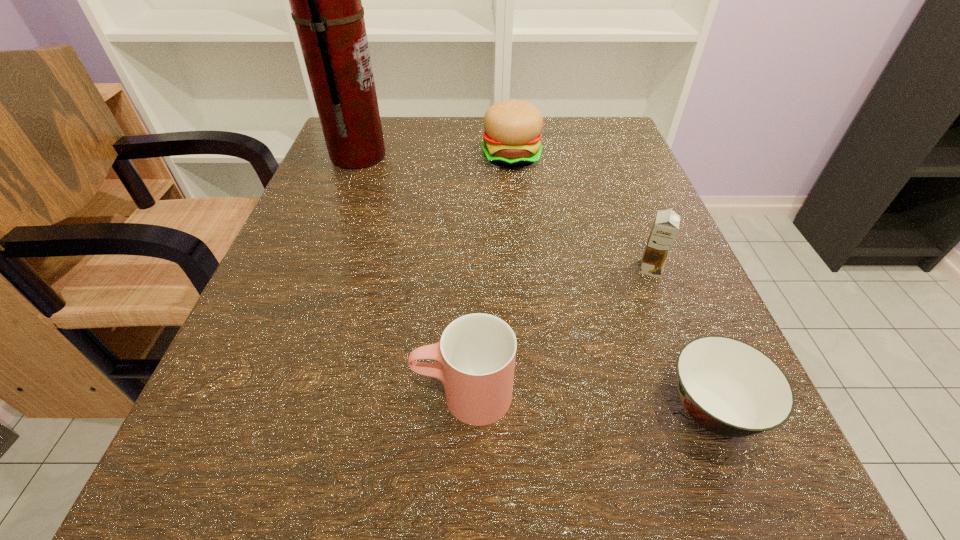
Locate an element on the screen. object present at the near right corner is located at coordinates (730, 388).

In order to click on free space at the far edge of the desktop in this screenshot , I will do `click(560, 172)`.

Locate an element on the screen. Image resolution: width=960 pixels, height=540 pixels. vacant area at the near edge of the desktop is located at coordinates (537, 476).

This screenshot has width=960, height=540. Find the location of `vacant region at the left edge of the desktop`. vacant region at the left edge of the desktop is located at coordinates (342, 222).

In the image, there is a desktop. Where is `free space at the right edge`? This screenshot has width=960, height=540. free space at the right edge is located at coordinates (639, 366).

At what (x,y) coordinates should I click in order to perform the action: click on free space at the far right corner of the desktop. Please return your answer as a coordinate pair (x, y). The height and width of the screenshot is (540, 960). Looking at the image, I should click on (574, 150).

You are a GUI agent. You are given a task and a screenshot of the screen. Output one action in this format:
    pyautogui.click(x=<x>, y=<y>)
    Task: Click on the free space at the near right corner of the desktop
    
    Given the screenshot: What is the action you would take?
    pyautogui.click(x=681, y=482)

The image size is (960, 540). Identify the location of unoccupied position between the hamburger and the soup bowl. (612, 284).

Image resolution: width=960 pixels, height=540 pixels. I want to click on vacant region between the third nearest object and the hamburger, so click(x=581, y=213).

Where is `free space between the third nearest object and the hamburger`? free space between the third nearest object and the hamburger is located at coordinates (581, 213).